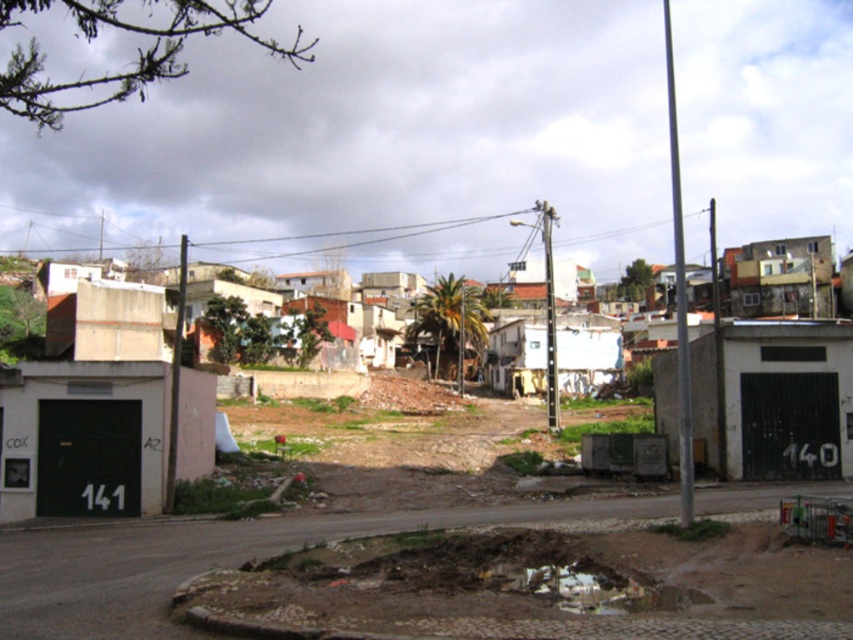
Question: Does brown soil at center appear on the right side of concrete building at center?

Choices:
 (A) no
 (B) yes

Answer: (A)

Question: Can you confirm if brown soil at center is wider than concrete building at center?

Choices:
 (A) no
 (B) yes

Answer: (A)

Question: Which point appears closest to the camera in this image?

Choices:
 (A) (351, 304)
 (B) (444, 454)

Answer: (B)

Question: Which object appears closest to the camera in this image?

Choices:
 (A) brown soil at center
 (B) concrete building at center

Answer: (B)

Question: Does brown soil at center come in front of concrete building at center?

Choices:
 (A) yes
 (B) no

Answer: (B)